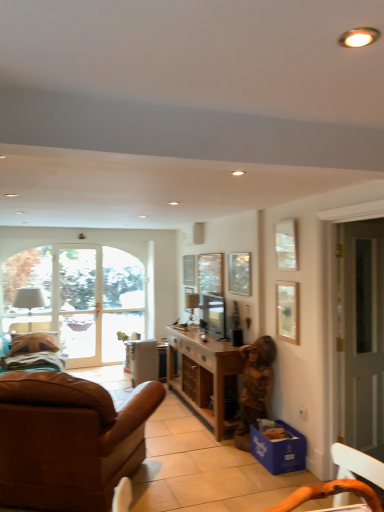
Question: From a real-world perspective, is clear glass window screen at center on top of wooden cabinet at center?

Choices:
 (A) yes
 (B) no

Answer: (A)

Question: From a real-world perspective, is clear glass window screen at center located beneath wooden cabinet at center?

Choices:
 (A) no
 (B) yes

Answer: (A)

Question: Does clear glass window screen at center have a lesser width compared to wooden cabinet at center?

Choices:
 (A) no
 (B) yes

Answer: (B)

Question: Is clear glass window screen at center to the left of wooden cabinet at center from the viewer's perspective?

Choices:
 (A) yes
 (B) no

Answer: (B)

Question: Can you confirm if clear glass window screen at center is bigger than wooden cabinet at center?

Choices:
 (A) yes
 (B) no

Answer: (B)

Question: Considering their positions, is matte white picture frame at upper right, marked as the third picture frame in a left-to-right arrangement, located in front of or behind wooden statue at lower right?

Choices:
 (A) behind
 (B) front

Answer: (B)

Question: From the image's perspective, is matte white picture frame at upper right, marked as the third picture frame in a left-to-right arrangement, located above or below wooden statue at lower right?

Choices:
 (A) above
 (B) below

Answer: (A)

Question: In terms of width, does matte white picture frame at upper right, acting as the first picture frame starting from the right, look wider or thinner when compared to wooden statue at lower right?

Choices:
 (A) thin
 (B) wide

Answer: (A)

Question: Considering the relative positions of matte white picture frame at upper right, which appears as the first picture frame when viewed from the front, and wooden statue at lower right in the image provided, is matte white picture frame at upper right, which appears as the first picture frame when viewed from the front, to the left or to the right of wooden statue at lower right?

Choices:
 (A) right
 (B) left

Answer: (A)

Question: In the image, is satin black television at center, the 2th television from the front, positioned in front of or behind clear glass door at center?

Choices:
 (A) front
 (B) behind

Answer: (A)

Question: Considering the positions of point (193, 296) and point (74, 351), is point (193, 296) closer or farther from the camera than point (74, 351)?

Choices:
 (A) closer
 (B) farther

Answer: (A)

Question: Is satin black television at center, the first television from the back, spatially inside clear glass door at center, or outside of it?

Choices:
 (A) inside
 (B) outside

Answer: (B)

Question: Looking at the image, does satin black television at center, the 2th television from the front, seem bigger or smaller compared to clear glass door at center?

Choices:
 (A) big
 (B) small

Answer: (B)

Question: Is blue cardboard box at lower right to the left or to the right of satin black television at center, the 2th television from the front, in the image?

Choices:
 (A) left
 (B) right

Answer: (B)

Question: Does point (291, 450) appear closer or farther from the camera than point (188, 309)?

Choices:
 (A) closer
 (B) farther

Answer: (A)